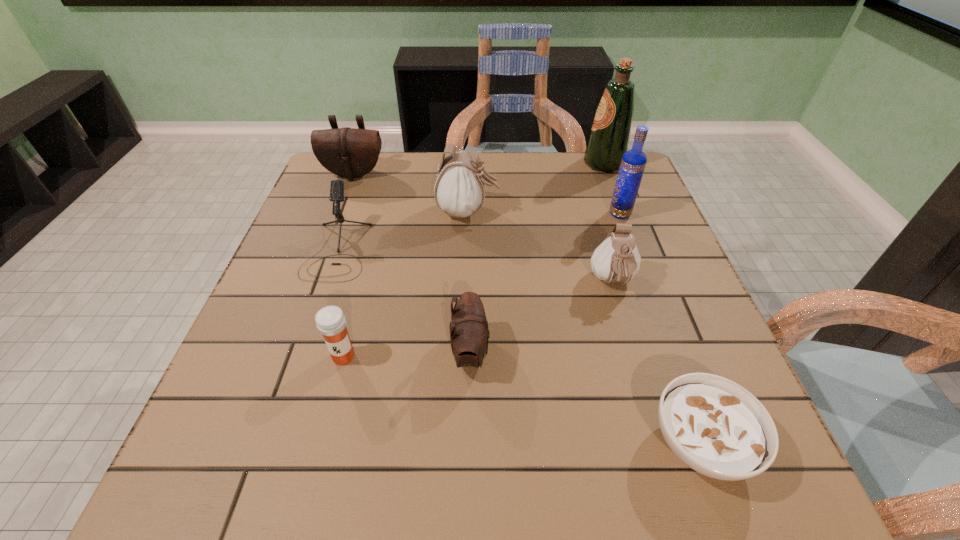
The image size is (960, 540). In order to click on free location located 0.340m on the front-facing side of the farther white pouch in this screenshot , I will do `click(631, 212)`.

Image resolution: width=960 pixels, height=540 pixels. I want to click on blank area located 0.110m with the flap open on the leftmost pouch, so click(x=342, y=206).

Locate an element on the screen. The height and width of the screenshot is (540, 960). vacant space located 0.260m on the front-facing side of the third farthest pouch is located at coordinates (653, 420).

Find the location of `free spot located 0.230m on the stand of the microphone`. free spot located 0.230m on the stand of the microphone is located at coordinates pos(295,374).

Where is `vacant area situated with the flap open on the nearest pouch`? vacant area situated with the flap open on the nearest pouch is located at coordinates (607, 353).

Locate an element on the screen. This screenshot has height=540, width=960. vacant space situated 0.180m on the label side of the medicine is located at coordinates (315, 467).

You are a GUI agent. You are given a task and a screenshot of the screen. Output one action in this format:
    pyautogui.click(x=<x>, y=<y>)
    Task: Click on the vacant space situated on the left of the soup bowl
    Image resolution: width=960 pixels, height=540 pixels.
    Given the screenshot: What is the action you would take?
    pyautogui.click(x=511, y=443)

Where is `olive oil positioned at the far edge`? Image resolution: width=960 pixels, height=540 pixels. olive oil positioned at the far edge is located at coordinates (609, 138).

Locate an element on the screen. object located at the near edge is located at coordinates (715, 426).

The width and height of the screenshot is (960, 540). Find the location of `pouch that is at the left edge`. pouch that is at the left edge is located at coordinates (347, 152).